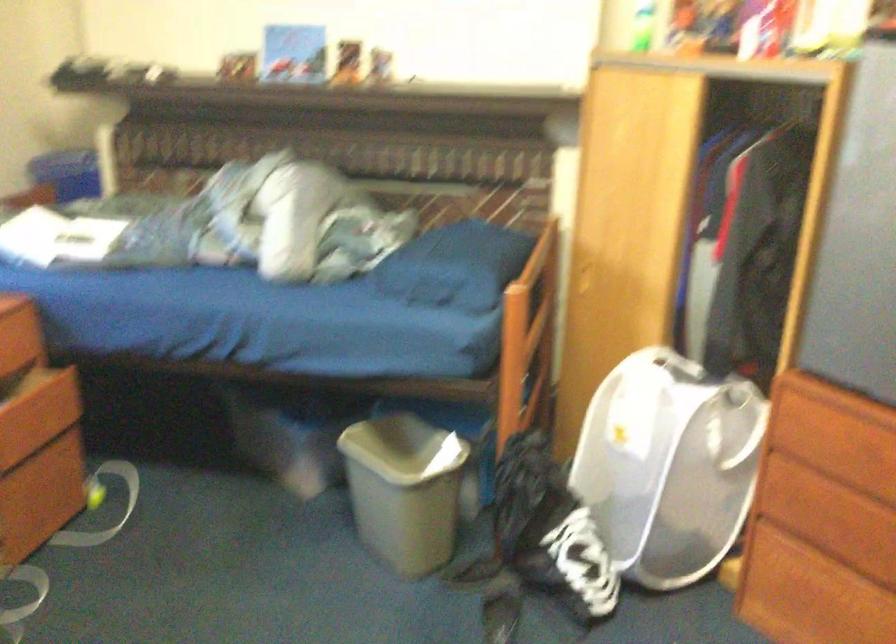
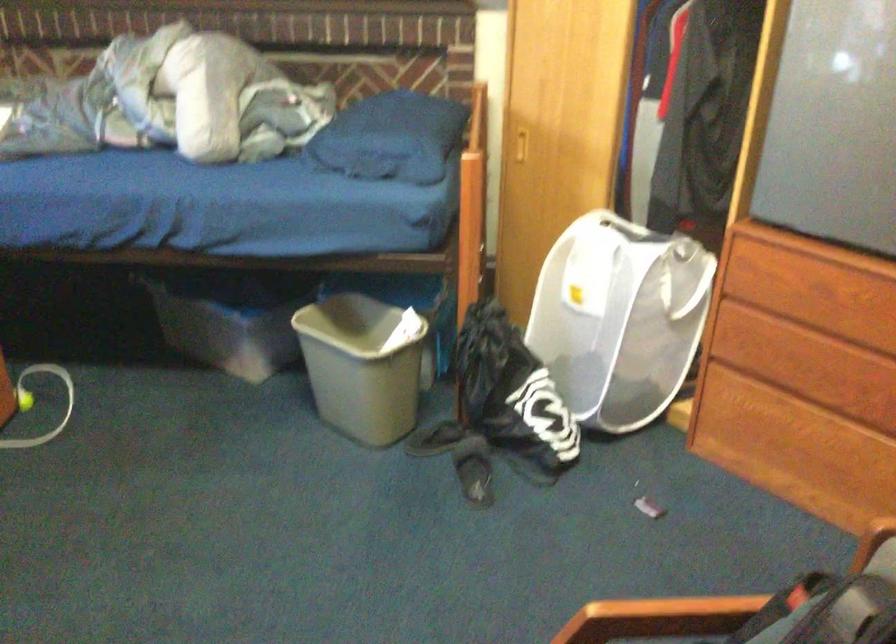
Where in the second image is the point corresponding to (549,532) from the first image?

(513, 395)